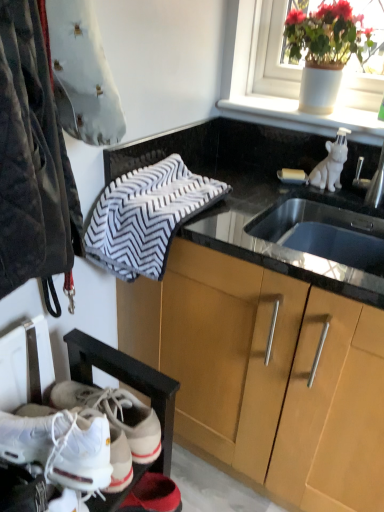
Question: Considering the positions of gray textured towel at upper center and velvet-like gray pillow at upper left, which is counted as the second animal, starting from the right, in the image, is gray textured towel at upper center bigger or smaller than velvet-like gray pillow at upper left, which is counted as the second animal, starting from the right,?

Choices:
 (A) small
 (B) big

Answer: (B)

Question: From the image's perspective, is gray textured towel at upper center positioned above or below velvet-like gray pillow at upper left, arranged as the 2th animal when viewed from the back?

Choices:
 (A) above
 (B) below

Answer: (B)

Question: Based on their relative distances, which object is farther from the velvet-like gray pillow at upper left, arranged as the 2th animal when viewed from the back?

Choices:
 (A) white ceramic pot at upper right
 (B) white glossy ceramic dog at upper right, the 2th animal from the front
 (C) wooden cabinet at center
 (D) white leather sneakers at lower left
 (E) gray textured towel at upper center

Answer: (B)

Question: Based on their relative distances, which object is farther from the gray textured towel at upper center?

Choices:
 (A) white leather sneakers at lower left
 (B) wooden cabinet at center
 (C) white ceramic pot at upper right
 (D) white glossy ceramic dog at upper right, the 2th animal from the front
 (E) velvet-like gray pillow at upper left, which is counted as the second animal, starting from the right

Answer: (C)